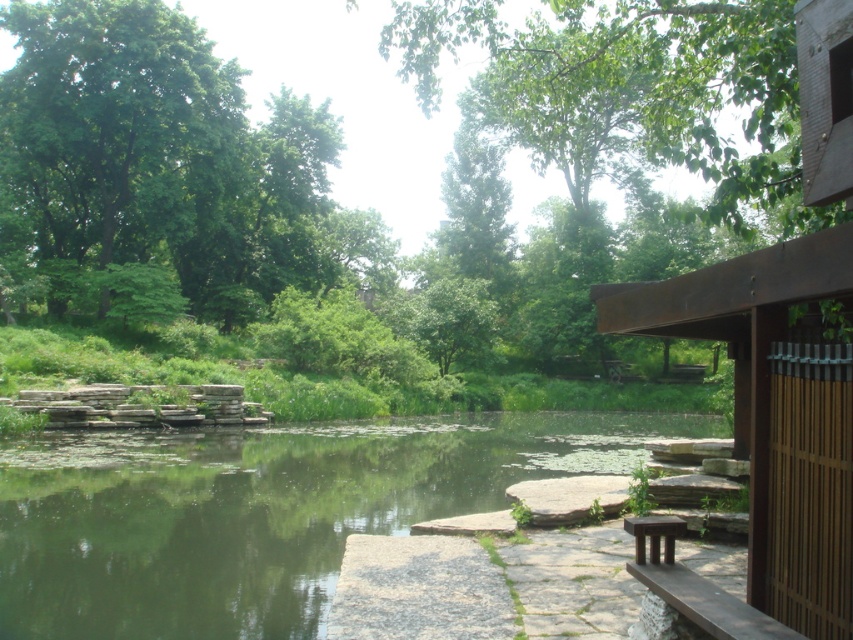
Between green stone river at center and green leafy tree at upper left, which one is positioned higher?

green leafy tree at upper left is higher up.

Who is more forward, (x=44, y=570) or (x=142, y=221)?

Point (x=44, y=570) is in front.

This screenshot has height=640, width=853. I want to click on green stone river at center, so click(259, 512).